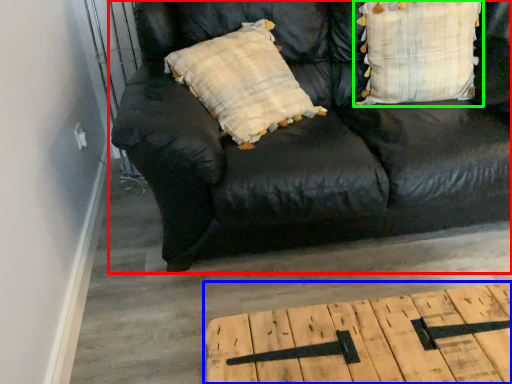
Question: Which object is positioned closest to studio couch (highlighted by a red box)? Select from table (highlighted by a blue box) and pillow (highlighted by a green box).

Choices:
 (A) table
 (B) pillow

Answer: (B)